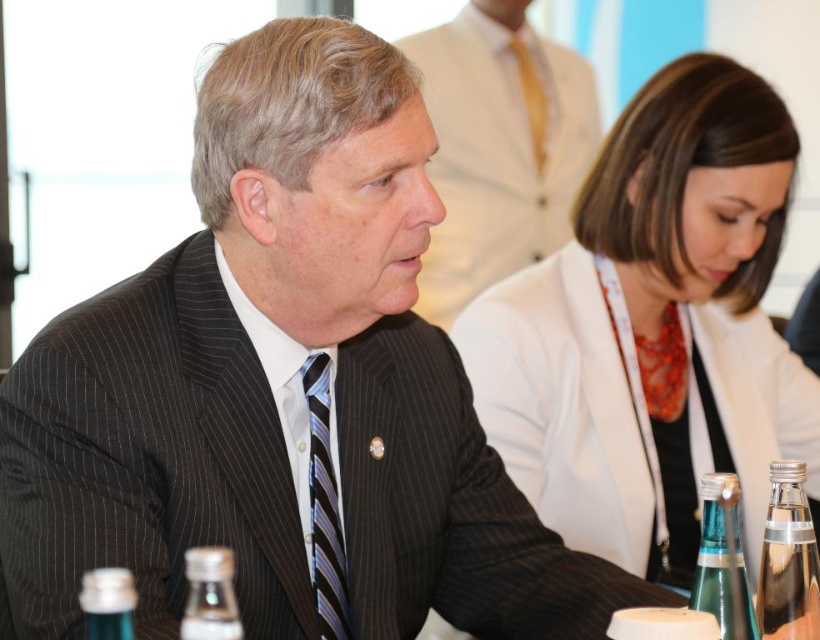
Does clear glass bottle at lower right appear over translucent glass bottle at lower left?

Yes, clear glass bottle at lower right is above translucent glass bottle at lower left.

Measure the distance between clear glass bottle at lower right and camera.

clear glass bottle at lower right and camera are 3.37 feet apart.

You are a GUI agent. You are given a task and a screenshot of the screen. Output one action in this format:
    pyautogui.click(x=<x>, y=<y>)
    Task: Click on the clear glass bottle at lower right
    
    Given the screenshot: What is the action you would take?
    pyautogui.click(x=787, y=560)

Can you confirm if white fabric jacket at center is taller than pinstriped suit at center?

Yes.

Describe the element at coordinates (652, 328) in the screenshot. I see `white fabric jacket at center` at that location.

The image size is (820, 640). What are the coordinates of `white fabric jacket at center` in the screenshot? It's located at (652, 328).

Can you confirm if clear glass bottle at lower right is positioned above clear glass bottle at lower left?

Yes.

Who is shorter, clear glass bottle at lower right or clear glass bottle at lower left?

clear glass bottle at lower left is shorter.

Which is in front, point (771, 476) or point (224, 621)?

Point (224, 621)

This screenshot has width=820, height=640. What are the coordinates of `clear glass bottle at lower right` in the screenshot? It's located at (787, 560).